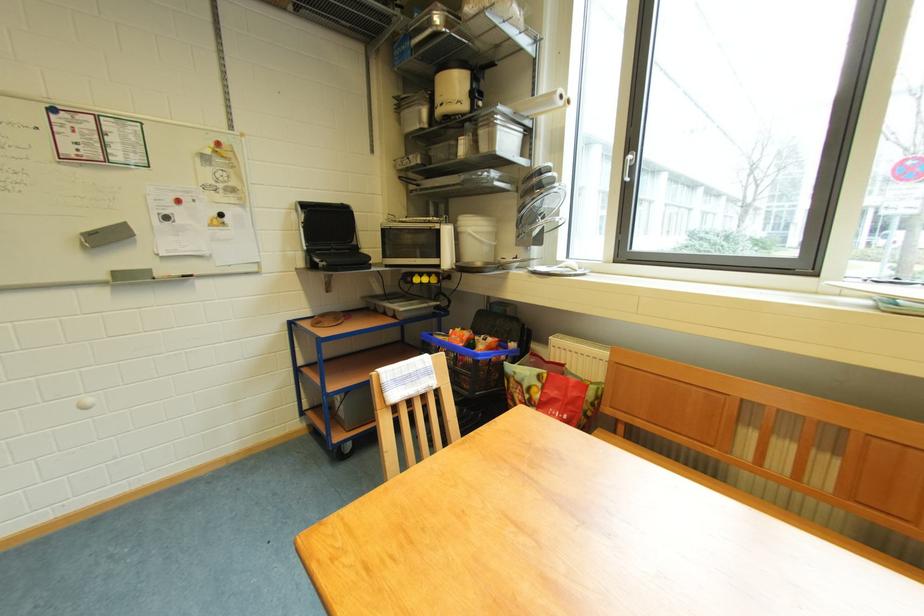
Locate an element on the screen. The width and height of the screenshot is (924, 616). bench sitting surface is located at coordinates (651, 455).